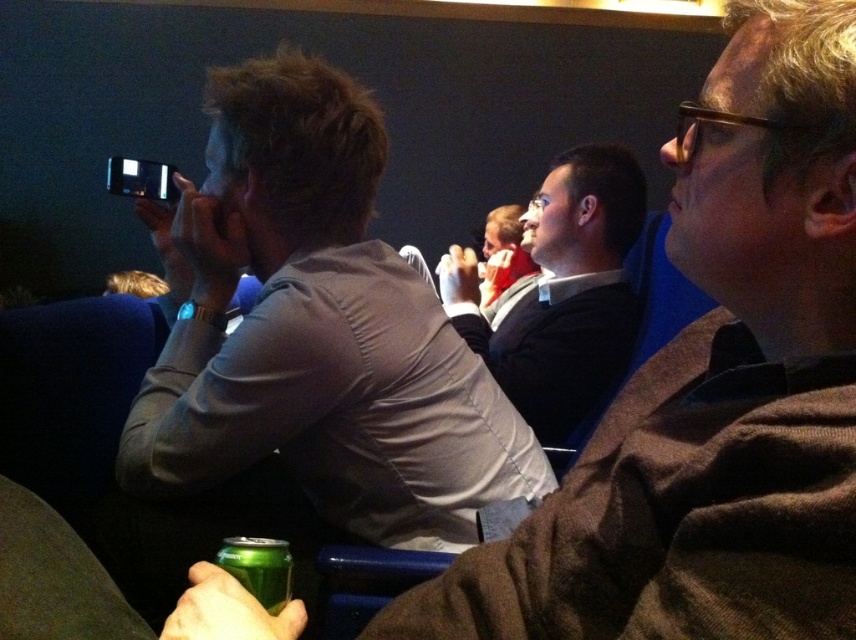
You are sitting in the auditorium and want to pass a note to the person wearing the matte gray shirt at center without being noticed. Since you are holding a green metallic can at lower left, can you use it to discreetly pass the note to them?

The matte gray shirt at center is further to the viewer than the green metallic can at lower left, so you can use the green metallic can at lower left as a discreet barrier to pass the note without being noticed.

You are sitting in the auditorium and want to move from your current position to the exit located at point (x=284, y=545). However, there is another person at point (x=322, y=272). Can you walk directly to the exit without going around them?

Point (x=322, y=272) is behind point (x=284, y=545), so you can walk directly to the exit at point (x=284, y=545) without needing to go around the person at point (x=322, y=272) because they are positioned behind the exit location.

You are standing in the auditorium and want to locate the matte gray shirt at center. According to the coordinates provided, where exactly should you look?

The matte gray shirt at center is located at the 2D coordinates point (314, 330).